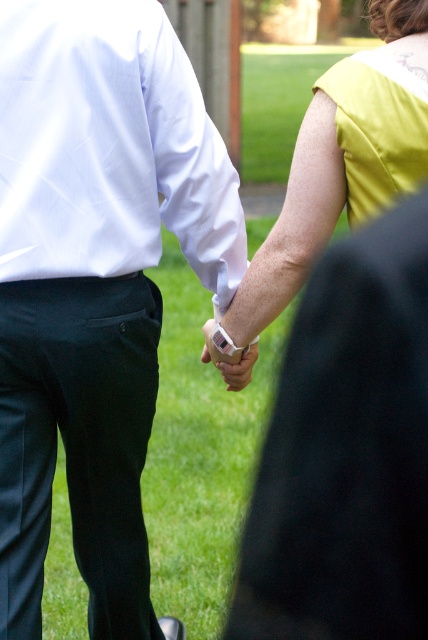
Can you confirm if white matte shirt at center is positioned below matte yellow dress at upper right?

Indeed, white matte shirt at center is positioned under matte yellow dress at upper right.

Between point (89, 284) and point (359, 56), which one is positioned behind?

The point (89, 284) is behind.

Locate an element on the screen. white matte shirt at center is located at coordinates (95, 282).

Based on the photo, between white matte shirt at center and white smooth dress shirt at center, which one has less height?

white smooth dress shirt at center

Between point (187, 225) and point (95, 45), which one is positioned in front?

Point (95, 45) is more forward.

Which is in front, point (107, 116) or point (119, 268)?

Point (107, 116)

You are a GUI agent. You are given a task and a screenshot of the screen. Output one action in this format:
    pyautogui.click(x=<x>, y=<y>)
    Task: Click on the white matte shirt at center
    
    Given the screenshot: What is the action you would take?
    pyautogui.click(x=95, y=282)

Based on the photo, who is higher up, white matte shirt at center or white matte wristband at center?

white matte shirt at center is higher up.

How much distance is there between white matte shirt at center and white matte wristband at center?

white matte shirt at center is 55.16 centimeters away from white matte wristband at center.

Which is behind, point (32, 614) or point (249, 371)?

The point (249, 371) is behind.

Where is `white matte shirt at center`? white matte shirt at center is located at coordinates (95, 282).